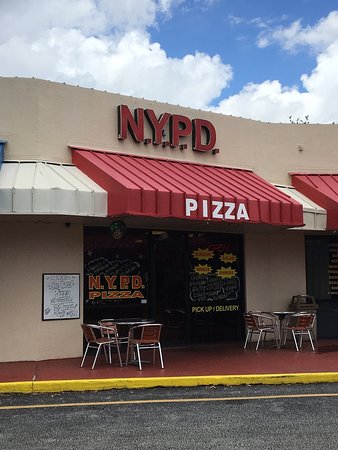
Locate an element on the screen. metal table is located at coordinates (284, 312), (130, 324).